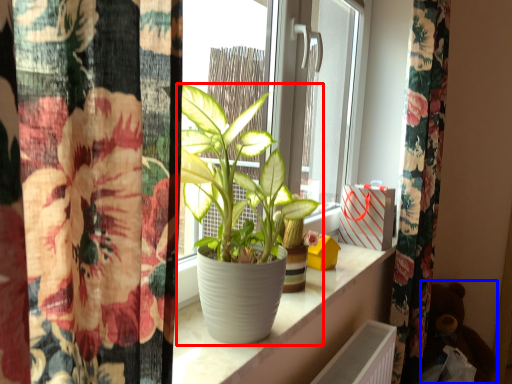
Question: Among these objects, which one is nearest to the camera, houseplant (highlighted by a red box) or toy (highlighted by a blue box)?

Choices:
 (A) houseplant
 (B) toy

Answer: (A)